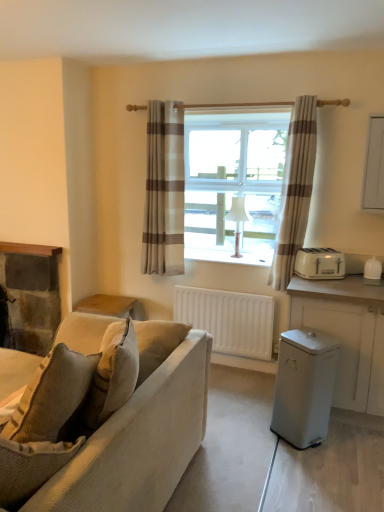
Locate an element on the screen. empty space that is ontop of white matte cabinet at right is located at coordinates (348, 283).